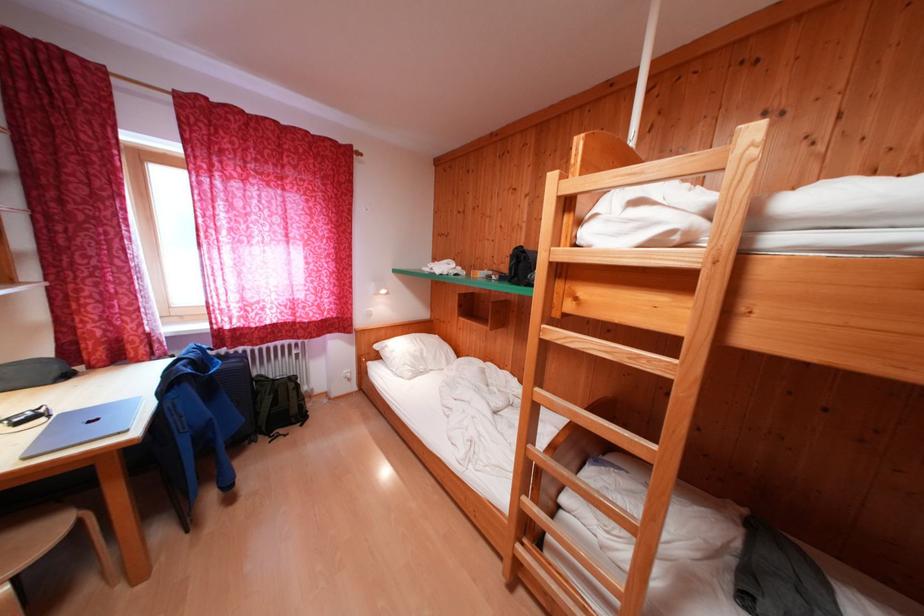
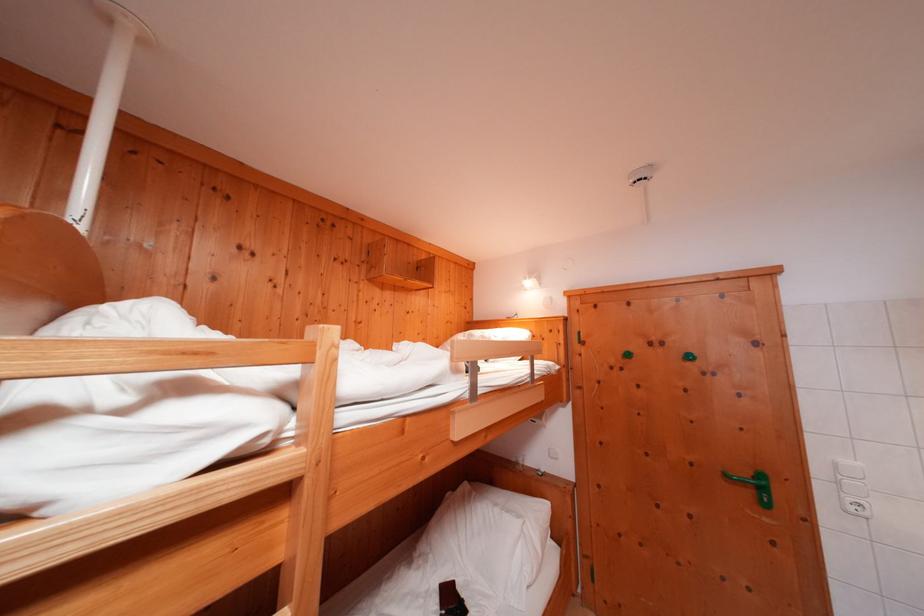
Question: The camera is either moving clockwise (left) or counter-clockwise (right) around the object. The first image is from the beginning of the video and the second image is from the end. Is the camera moving left or right when shooting the video?

Choices:
 (A) Left
 (B) Right

Answer: (A)